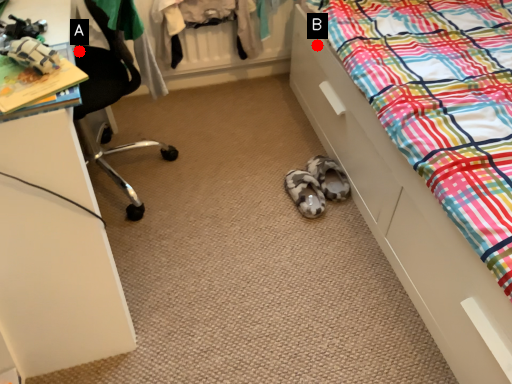
Question: Two points are circled on the image, labeled by A and B beside each circle. Which point is further to the camera?

Choices:
 (A) A is further
 (B) B is further

Answer: (B)